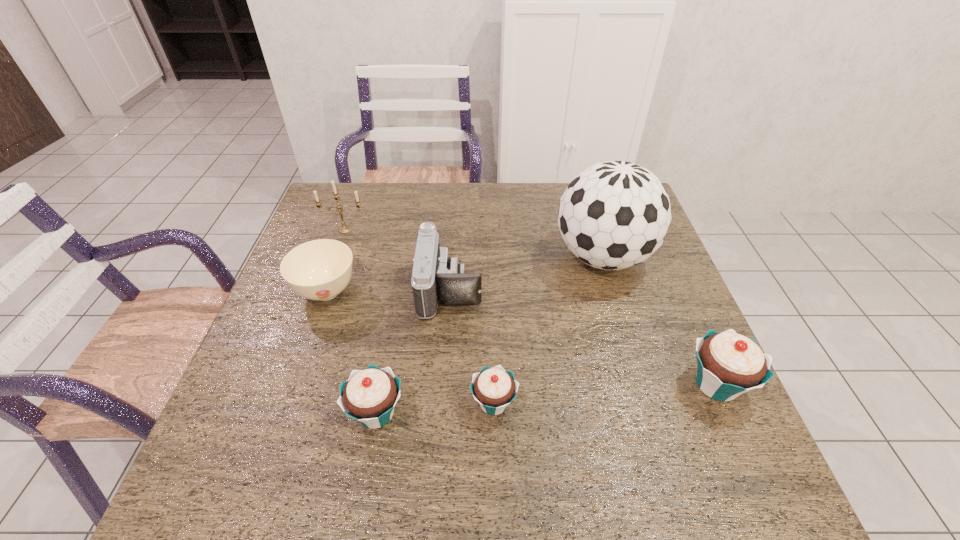
Identify the location of vacant space that satisfies the following two spatial constraints: 1. on the front side of the candle; 2. on the left side of the rightmost cupcake. Image resolution: width=960 pixels, height=540 pixels. (290, 384).

Locate an element on the screen. free region that satisfies the following two spatial constraints: 1. on the back side of the second shortest cupcake; 2. on the left side of the second cupcake from right to left is located at coordinates (378, 403).

I want to click on free location that satisfies the following two spatial constraints: 1. on the front side of the sugar bowl; 2. on the left side of the candle, so click(x=324, y=292).